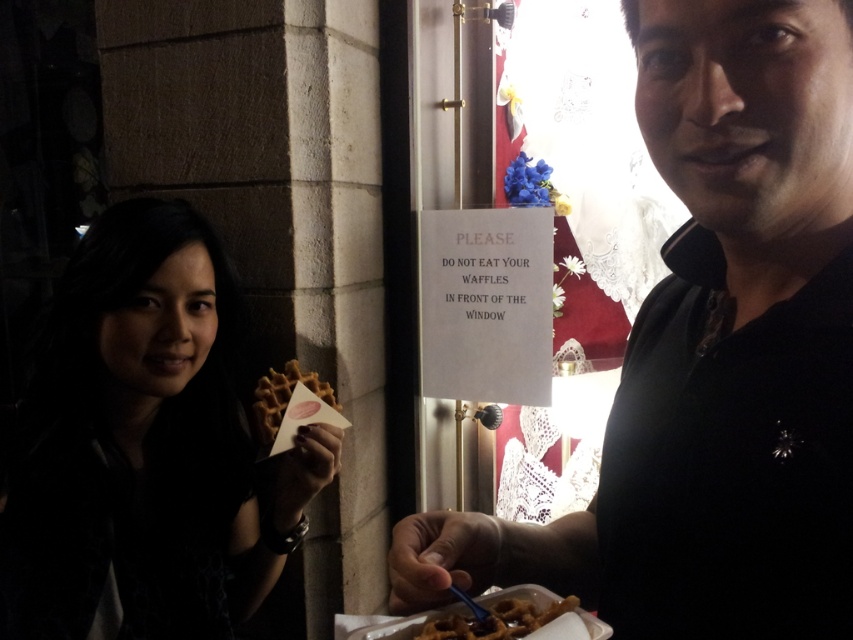
Who is taller, golden brown crispy waffle at lower center or golden brown waffle at center?

golden brown waffle at center is taller.

Locate an element on the screen. This screenshot has height=640, width=853. golden brown crispy waffle at lower center is located at coordinates (496, 620).

Does black matte shirt at center come in front of golden brown waffle at center?

Yes, black matte shirt at center is in front of golden brown waffle at center.

Does black matte shirt at center have a greater width compared to golden brown waffle at center?

Answer: Indeed, black matte shirt at center has a greater width compared to golden brown waffle at center.

Which is in front, point (759, 108) or point (288, 401)?

Point (759, 108) is more forward.

Identify the location of black matte shirt at center. (712, 356).

Looking at this image, does matte brown waffle at left have a lesser height compared to golden brown waffle at center?

No.

Who is more distant from viewer, (196, 428) or (312, 376)?

Point (312, 376)

This screenshot has height=640, width=853. Find the location of `matte brown waffle at left`. matte brown waffle at left is located at coordinates pos(146,449).